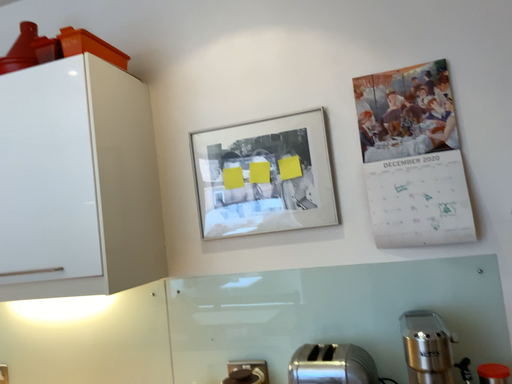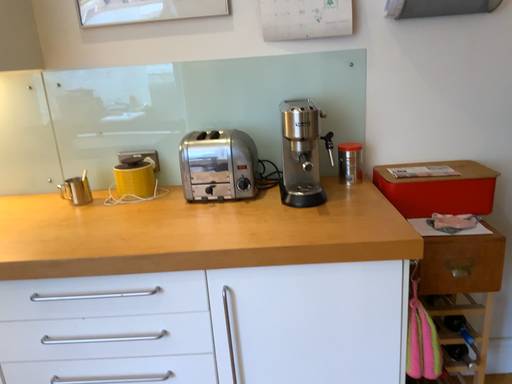
Question: How did the camera likely rotate when shooting the video?

Choices:
 (A) rotated downward
 (B) rotated upward

Answer: (A)